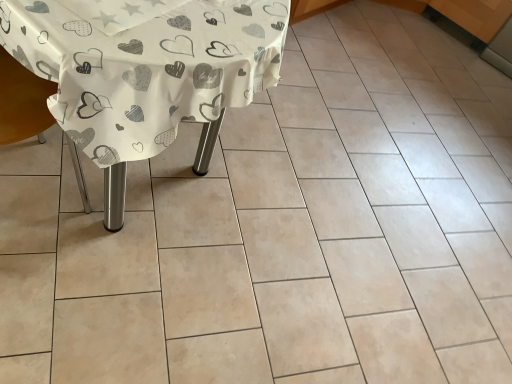
Question: From the image's perspective, is white paper with heart patterns at center located above or below wooden armchair at left?

Choices:
 (A) above
 (B) below

Answer: (A)

Question: Visually, is white paper with heart patterns at center positioned to the left or to the right of wooden armchair at left?

Choices:
 (A) right
 (B) left

Answer: (A)

Question: Is point (280, 8) closer or farther from the camera than point (37, 132)?

Choices:
 (A) closer
 (B) farther

Answer: (B)

Question: Is wooden armchair at left inside or outside of white paper with heart patterns at center?

Choices:
 (A) outside
 (B) inside

Answer: (A)

Question: From a real-world perspective, relative to white paper with heart patterns at center, is wooden armchair at left vertically above or below?

Choices:
 (A) below
 (B) above

Answer: (A)

Question: Considering the relative positions of wooden armchair at left and white paper with heart patterns at center in the image provided, is wooden armchair at left to the left or to the right of white paper with heart patterns at center?

Choices:
 (A) left
 (B) right

Answer: (A)

Question: From the image's perspective, is wooden armchair at left located above or below white paper with heart patterns at center?

Choices:
 (A) below
 (B) above

Answer: (A)